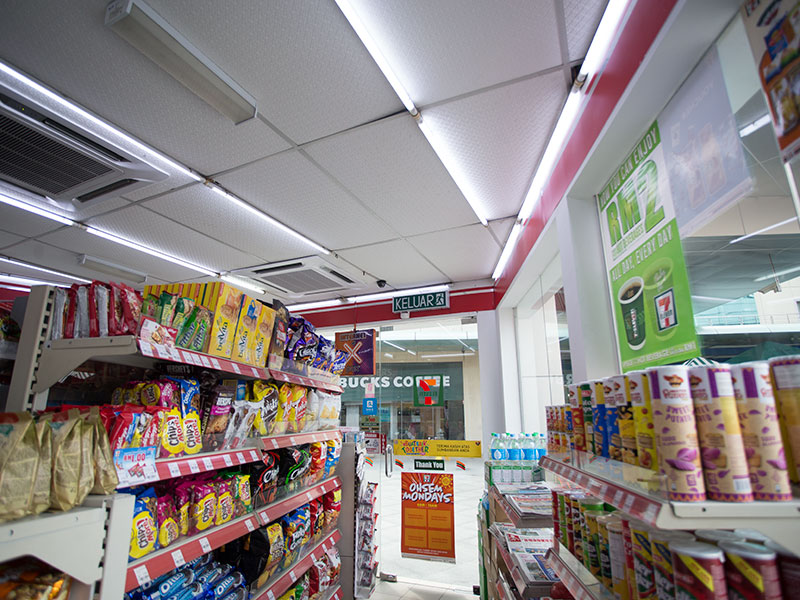
Where is `newspapers`? newspapers is located at coordinates (534, 561), (528, 536), (514, 527), (529, 503).